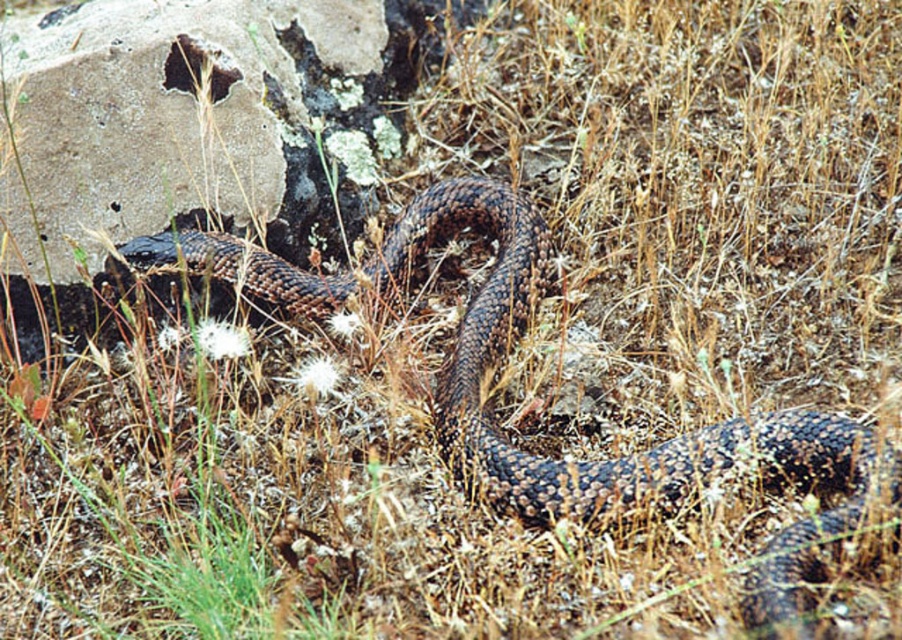
You are standing at the center of the image and want to move towards the rough concrete boulder at left. In which direction should you go?

The rough concrete boulder at left is located at point 0.189 on the x and y axis, so you should move towards the left and slightly downward.

You are a hiker who wants to place a small first aid kit between the rough concrete boulder at left and the brown scaly snake at center. Can you fit it there if the kit requires 1.2 meters of space?

The rough concrete boulder at left has a lesser width compared to the brown scaly snake at center. Since the boulder is narrower, the space between them might be sufficient for the first aid kit requiring 1.2 meters, but the exact distance isn